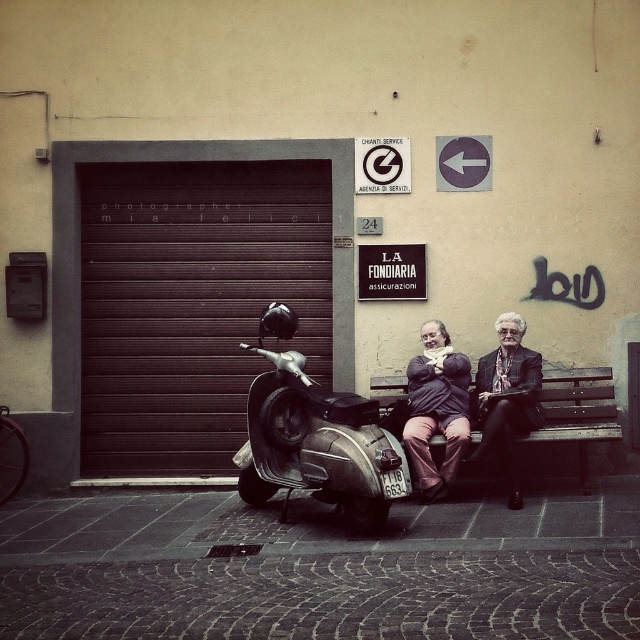
Question: Is shiny metallic scooter at center to the right of wooden bench at center from the viewer's perspective?

Choices:
 (A) yes
 (B) no

Answer: (B)

Question: Can you confirm if black metal/grey textured garage door at center is thinner than shiny metallic scooter at center?

Choices:
 (A) no
 (B) yes

Answer: (A)

Question: Based on their relative distances, which object is farther from the shiny metallic scooter at center?

Choices:
 (A) matte black coat at center
 (B) black metal/grey textured garage door at center
 (C) matte black jacket at center
 (D) wooden bench at center

Answer: (D)

Question: Can you confirm if matte black jacket at center is positioned to the left of wooden bench at center?

Choices:
 (A) no
 (B) yes

Answer: (B)

Question: Which point is farther to the camera?

Choices:
 (A) shiny metallic scooter at center
 (B) matte black coat at center

Answer: (B)

Question: Which point is farther to the camera?

Choices:
 (A) matte black jacket at center
 (B) shiny metallic scooter at center

Answer: (A)